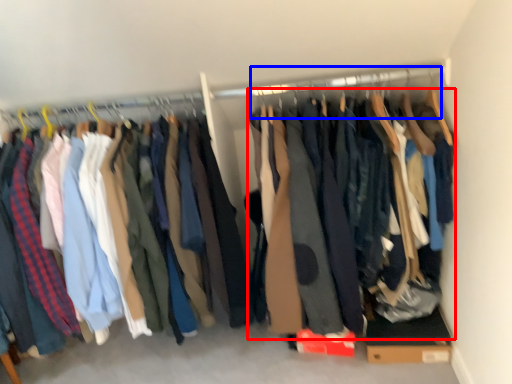
Question: Which object appears farthest to the camera in this image, clothing (highlighted by a red box) or hanger (highlighted by a blue box)?

Choices:
 (A) clothing
 (B) hanger

Answer: (B)